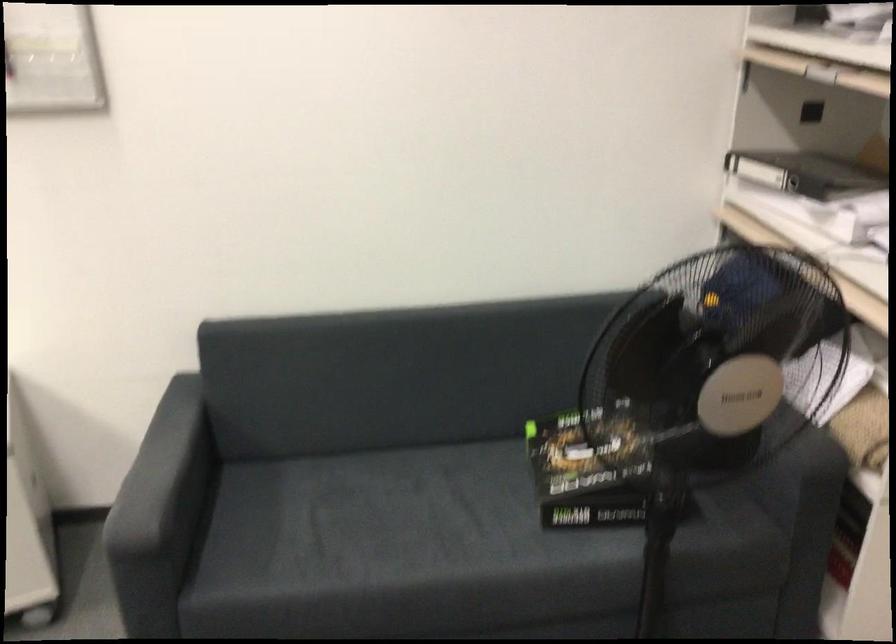
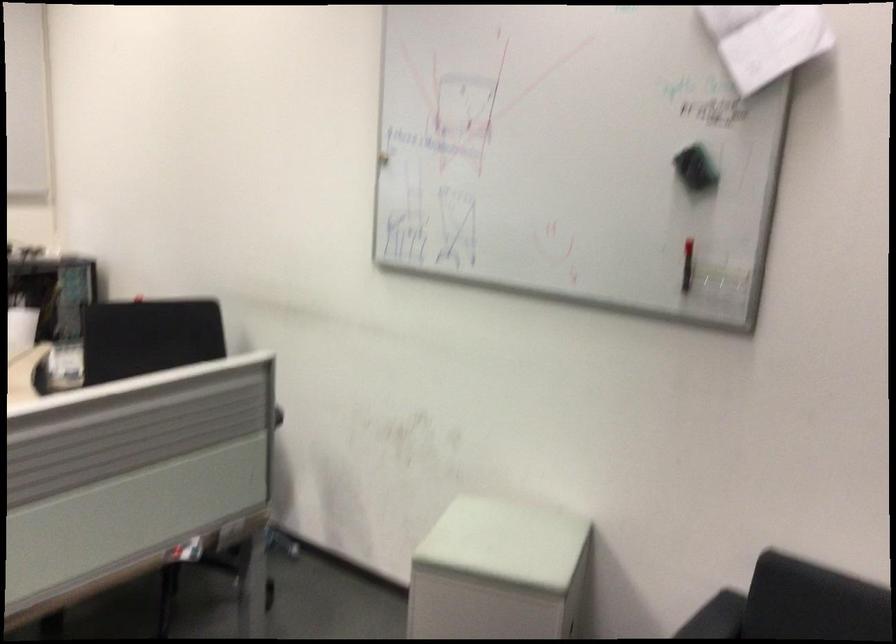
Question: The camera is either moving clockwise (left) or counter-clockwise (right) around the object. The first image is from the beginning of the video and the second image is from the end. Is the camera moving left or right when shooting the video?

Choices:
 (A) Left
 (B) Right

Answer: (B)